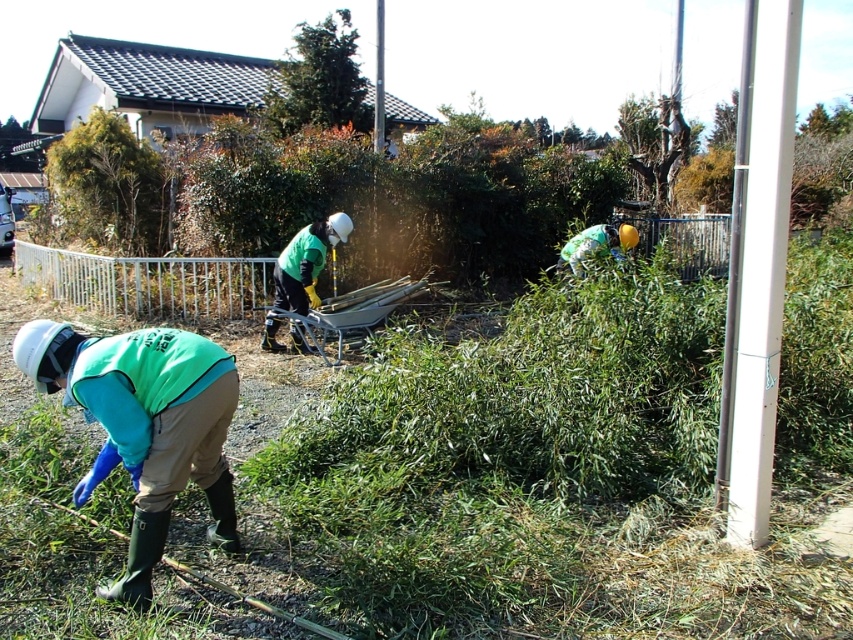
Between green matte jacket at lower left and green fabric jacket at center, which one is positioned lower?

green matte jacket at lower left is lower down.

Is point (146, 556) behind point (315, 220)?

That is False.

Locate an element on the screen. This screenshot has width=853, height=640. green matte jacket at lower left is located at coordinates (144, 426).

Image resolution: width=853 pixels, height=640 pixels. Identify the location of green matte jacket at lower left. (144, 426).

Does green fabric jacket at center have a lesser height compared to green fabric shirt at upper center?

No, green fabric jacket at center is not shorter than green fabric shirt at upper center.

In the scene shown: Is green fabric jacket at center above green fabric shirt at upper center?

Incorrect, green fabric jacket at center is not positioned above green fabric shirt at upper center.

This screenshot has width=853, height=640. Describe the element at coordinates (306, 262) in the screenshot. I see `green fabric jacket at center` at that location.

The image size is (853, 640). Find the location of `green fabric jacket at center`. green fabric jacket at center is located at coordinates (306, 262).

Is green matte jacket at lower left taller than green fabric shirt at upper center?

Yes.

Between point (91, 410) and point (618, 252), which one is positioned in front?

Positioned in front is point (91, 410).

The image size is (853, 640). What do you see at coordinates (144, 426) in the screenshot?
I see `green matte jacket at lower left` at bounding box center [144, 426].

Find the location of `green matte jacket at lower left`. green matte jacket at lower left is located at coordinates click(144, 426).